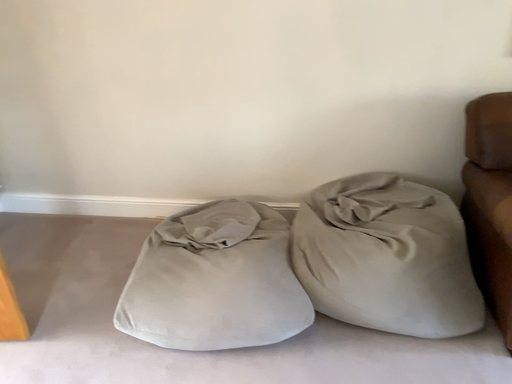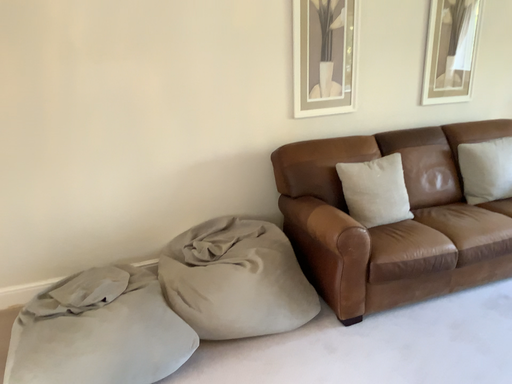
Question: How did the camera likely rotate when shooting the video?

Choices:
 (A) rotated left
 (B) rotated right

Answer: (B)